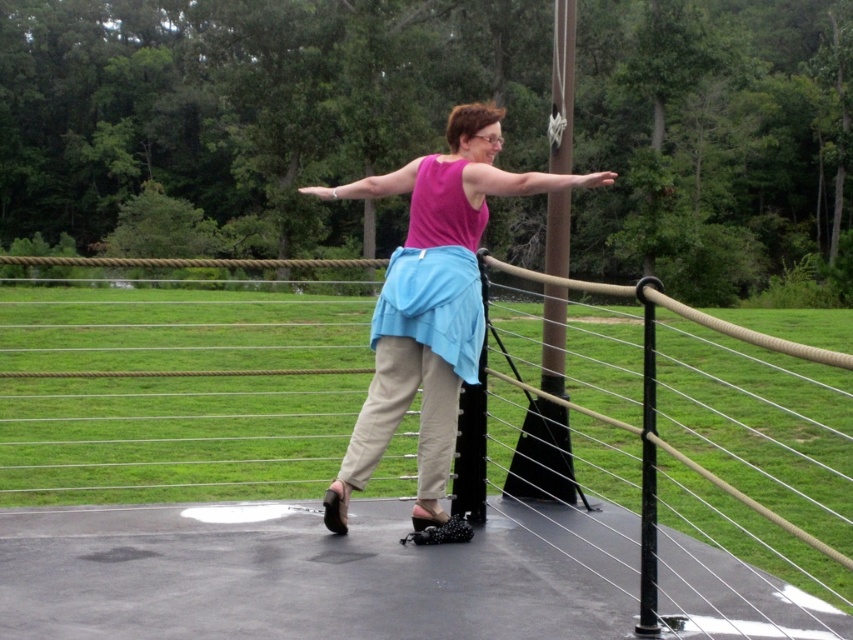
Does ropematerialfence at center have a lesser width compared to pink fabric skirt at center?

In fact, ropematerialfence at center might be wider than pink fabric skirt at center.

Is point (738, 556) positioned behind point (335, 186)?

No, it is not.

This screenshot has height=640, width=853. I want to click on ropematerialfence at center, so click(567, 499).